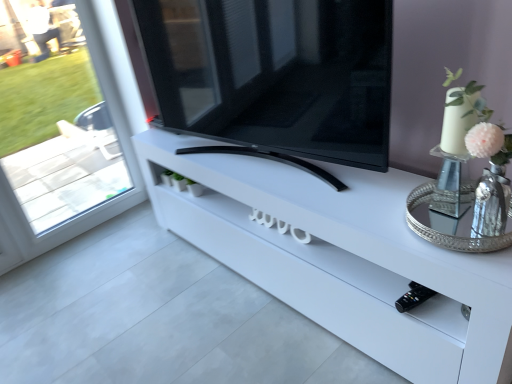
Question: Is silver metallic tray at right next to black glossy tv at center?

Choices:
 (A) no
 (B) yes

Answer: (A)

Question: Is silver metallic tray at right shorter than black glossy tv at center?

Choices:
 (A) no
 (B) yes

Answer: (B)

Question: Does silver metallic tray at right have a greater height compared to black glossy tv at center?

Choices:
 (A) yes
 (B) no

Answer: (B)

Question: Is silver metallic tray at right thinner than black glossy tv at center?

Choices:
 (A) no
 (B) yes

Answer: (A)

Question: Considering the relative positions of silver metallic tray at right and black glossy tv at center in the image provided, is silver metallic tray at right in front of black glossy tv at center?

Choices:
 (A) yes
 (B) no

Answer: (A)

Question: From a real-world perspective, is silver metallic tray at right physically below black glossy tv at center?

Choices:
 (A) no
 (B) yes

Answer: (B)

Question: Is black glossy tv at center further to camera compared to white glossy tv stand at center?

Choices:
 (A) no
 (B) yes

Answer: (B)

Question: Does black glossy tv at center have a greater width compared to white glossy tv stand at center?

Choices:
 (A) no
 (B) yes

Answer: (A)

Question: Is the position of black glossy tv at center less distant than that of white glossy tv stand at center?

Choices:
 (A) no
 (B) yes

Answer: (A)

Question: Is black glossy tv at center taller than white glossy tv stand at center?

Choices:
 (A) no
 (B) yes

Answer: (B)

Question: Is black glossy tv at center shorter than white glossy tv stand at center?

Choices:
 (A) yes
 (B) no

Answer: (B)

Question: From the image's perspective, does black glossy tv at center appear lower than white glossy tv stand at center?

Choices:
 (A) no
 (B) yes

Answer: (A)

Question: Can you confirm if silver metallic tray at right is taller than white glossy tv stand at center?

Choices:
 (A) no
 (B) yes

Answer: (A)